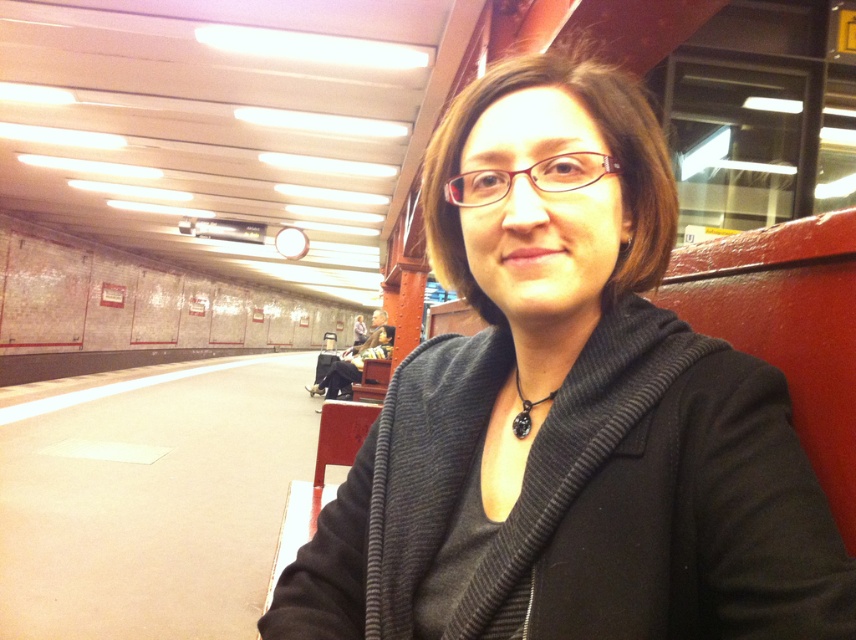
You are a fashion designer observing a person in a subway station. You notice the black textured sweater at center and the black leather pendant at center. Which item is positioned higher on the person?

The black textured sweater at center is above the black leather pendant at center, so the sweater is positioned higher on the person.

You are a photographer trying to capture the entire subway station platform in one shot. You notice two points marked in the scene at coordinates point (783, 605) and point (521, 422). Which point should you focus on to ensure both points are in sharp focus?

To ensure both points are in sharp focus, focus on point (521, 422) since it is farther from the camera than point (783, 605). Focusing on the farther point will maximize the depth of field, allowing both points to be in focus.